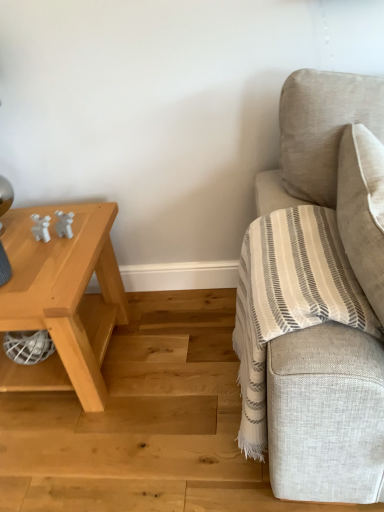
Question: From a real-world perspective, relative to natural wood stair at lower right, is light wood table at left vertically above or below?

Choices:
 (A) below
 (B) above

Answer: (B)

Question: Is light wood table at left in front of or behind natural wood stair at lower right in the image?

Choices:
 (A) front
 (B) behind

Answer: (B)

Question: Estimate the real-world distances between objects in this image. Which object is closer to the light wood table at left?

Choices:
 (A) beige fabric couch at right
 (B) natural wood stair at lower right

Answer: (B)

Question: Estimate the real-world distances between objects in this image. Which object is closer to the light wood table at left?

Choices:
 (A) beige fabric couch at right
 (B) natural wood stair at lower right

Answer: (B)